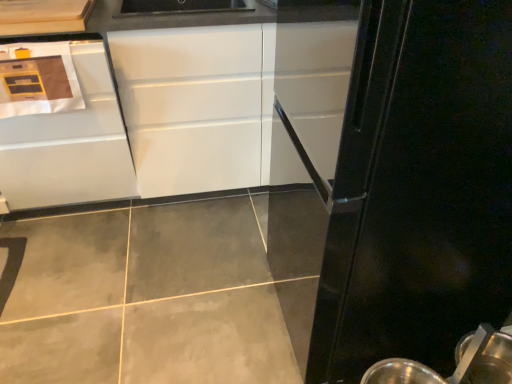
Question: Is metallic silver spoon at lower right thinner than white glossy cabinet at left, the 1th cabinetry from the left?

Choices:
 (A) no
 (B) yes

Answer: (B)

Question: Is metallic silver spoon at lower right at the left side of white glossy cabinet at left, the 1th cabinetry from the left?

Choices:
 (A) yes
 (B) no

Answer: (B)

Question: From the image's perspective, is metallic silver spoon at lower right under white glossy cabinet at left, the 1th cabinetry from the left?

Choices:
 (A) no
 (B) yes

Answer: (B)

Question: Is metallic silver spoon at lower right bigger than white glossy cabinet at left, the 1th cabinetry from the left?

Choices:
 (A) yes
 (B) no

Answer: (B)

Question: Is the surface of metallic silver spoon at lower right in direct contact with white glossy cabinet at left, the 1th cabinetry from the left?

Choices:
 (A) no
 (B) yes

Answer: (A)

Question: Considering the positions of point (71, 180) and point (462, 180), is point (71, 180) closer or farther from the camera than point (462, 180)?

Choices:
 (A) closer
 (B) farther

Answer: (B)

Question: Would you say white glossy cabinet at left, the 1th cabinetry from the left, is to the left or to the right of black glossy refrigerator at right in the picture?

Choices:
 (A) left
 (B) right

Answer: (A)

Question: From the image's perspective, is white glossy cabinet at left, the 1th cabinetry from the left, positioned above or below black glossy refrigerator at right?

Choices:
 (A) above
 (B) below

Answer: (A)

Question: Relative to black glossy refrigerator at right, is white glossy cabinet at left, the 1th cabinetry from the left, in front or behind?

Choices:
 (A) front
 (B) behind

Answer: (B)

Question: Is white glossy cabinet at center, acting as the 2th cabinetry starting from the left, taller or shorter than white glossy cabinet at left, the 2th cabinetry positioned from the right?

Choices:
 (A) tall
 (B) short

Answer: (A)

Question: Do you think white glossy cabinet at center, the first cabinetry positioned from the right, is within white glossy cabinet at left, the 2th cabinetry positioned from the right, or outside of it?

Choices:
 (A) outside
 (B) inside

Answer: (A)

Question: Considering the relative positions of white glossy cabinet at center, the first cabinetry positioned from the right, and white glossy cabinet at left, the 2th cabinetry positioned from the right, in the image provided, is white glossy cabinet at center, the first cabinetry positioned from the right, to the left or to the right of white glossy cabinet at left, the 2th cabinetry positioned from the right,?

Choices:
 (A) left
 (B) right

Answer: (B)

Question: Is white glossy cabinet at center, the first cabinetry positioned from the right, wider or thinner than white glossy cabinet at left, the 1th cabinetry from the left?

Choices:
 (A) wide
 (B) thin

Answer: (B)

Question: Based on their sizes in the image, would you say black glossy refrigerator at right is bigger or smaller than white glossy cabinet at center, acting as the 2th cabinetry starting from the left?

Choices:
 (A) small
 (B) big

Answer: (A)

Question: Does point (406, 54) appear closer or farther from the camera than point (31, 168)?

Choices:
 (A) closer
 (B) farther

Answer: (A)